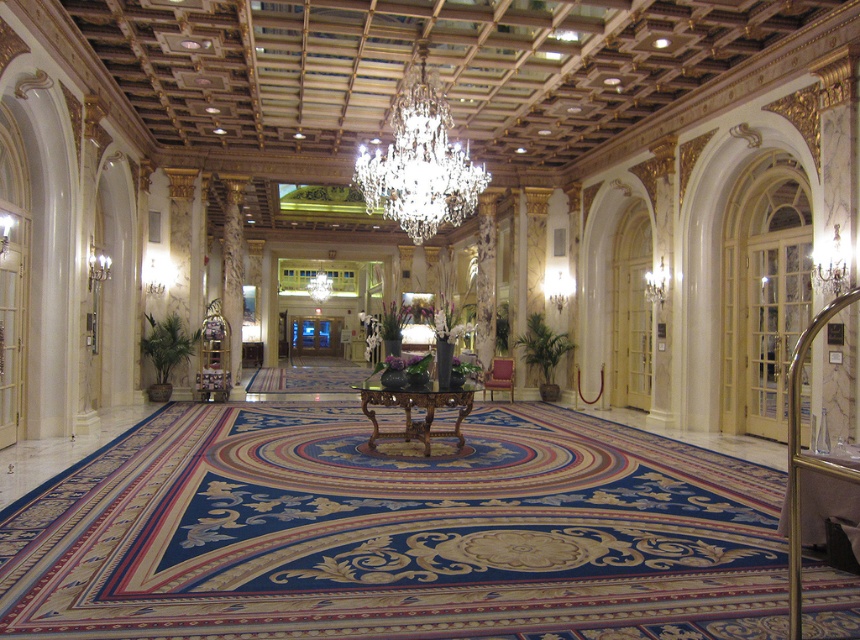
Which is in front, point (369, 296) or point (501, 380)?

Point (501, 380)

Can you confirm if gold metallic door at center is positioned above satin burgundy chair at center?

Yes.

Is point (310, 333) more distant than point (499, 381)?

That is True.

You are a GUI agent. You are given a task and a screenshot of the screen. Output one action in this format:
    pyautogui.click(x=<x>, y=<y>)
    Task: Click on the gold metallic door at center
    
    Given the screenshot: What is the action you would take?
    pyautogui.click(x=327, y=305)

Can you confirm if crystal glass chandelier at center is taller than gold metallic door at center?

Yes, crystal glass chandelier at center is taller than gold metallic door at center.

Can you confirm if crystal glass chandelier at center is bigger than gold metallic door at center?

Indeed, crystal glass chandelier at center has a larger size compared to gold metallic door at center.

Who is more forward, (408, 172) or (316, 344)?

Positioned in front is point (408, 172).

At what (x,y) coordinates should I click in order to perform the action: click on crystal glass chandelier at center. Please return your answer as a coordinate pair (x, y). The height and width of the screenshot is (640, 860). Looking at the image, I should click on (419, 163).

Is crystal glass chandelier at center below satin burgundy chair at center?

Actually, crystal glass chandelier at center is above satin burgundy chair at center.

The width and height of the screenshot is (860, 640). What do you see at coordinates (419, 163) in the screenshot? I see `crystal glass chandelier at center` at bounding box center [419, 163].

Locate an element on the screen. This screenshot has width=860, height=640. crystal glass chandelier at center is located at coordinates 419,163.